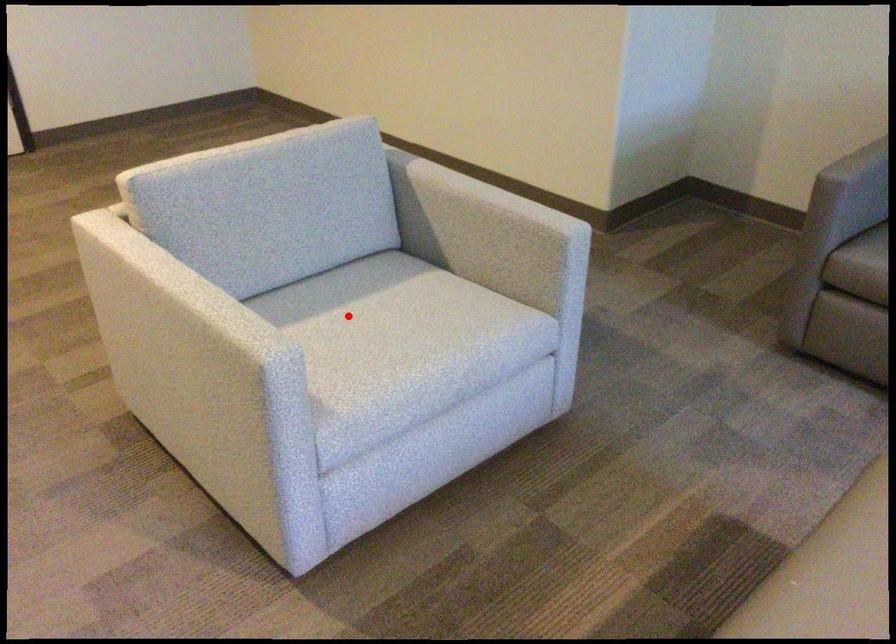
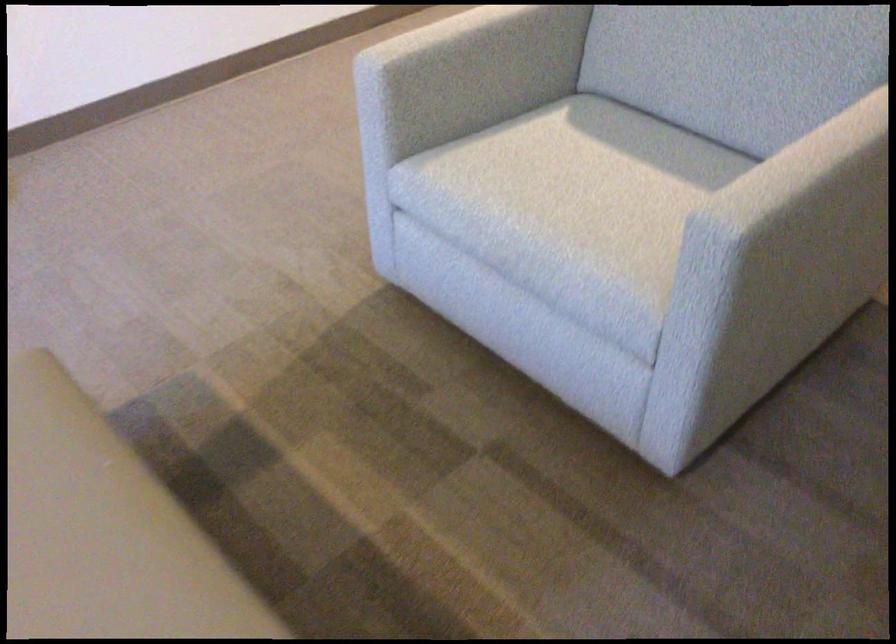
In the second image, find the point that corresponds to the highlighted location in the first image.

(607, 169)